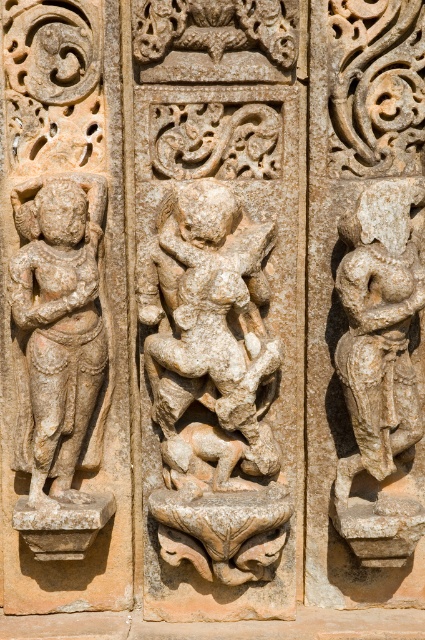
Question: Which object is positioned farthest from the stone carved figure at left?

Choices:
 (A) stone carved figure at center
 (B) stone statue at center

Answer: (B)

Question: Which is farther from the stone carved figure at left?

Choices:
 (A) stone statue at center
 (B) stone carved figure at center

Answer: (A)

Question: Can you confirm if stone carved figure at center is bigger than stone carved figure at left?

Choices:
 (A) no
 (B) yes

Answer: (B)

Question: Is stone carved figure at center to the right of stone carved figure at left from the viewer's perspective?

Choices:
 (A) no
 (B) yes

Answer: (B)

Question: Is stone statue at center wider than stone carved figure at left?

Choices:
 (A) no
 (B) yes

Answer: (A)

Question: Estimate the real-world distances between objects in this image. Which object is closer to the stone carved figure at left?

Choices:
 (A) stone carved figure at center
 (B) stone statue at center

Answer: (A)